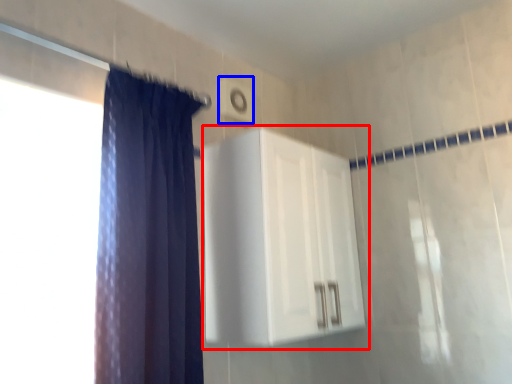
Question: Among these objects, which one is farthest to the camera, dresser (highlighted by a red box) or light switch (highlighted by a blue box)?

Choices:
 (A) dresser
 (B) light switch

Answer: (B)